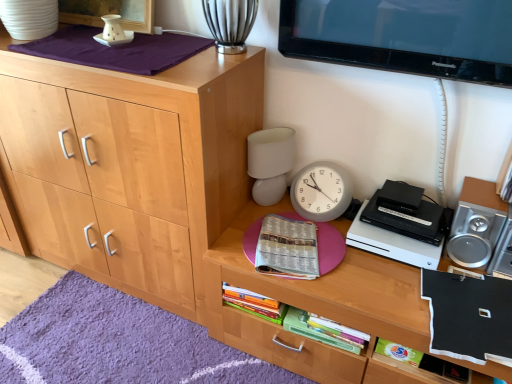
How much space does black matte book at lower right, acting as the 1th book starting from the right, occupy vertically?

The height of black matte book at lower right, acting as the 1th book starting from the right, is 1.84 inches.

The width and height of the screenshot is (512, 384). Describe the element at coordinates (469, 316) in the screenshot. I see `black matte book at lower right, the 3th book from the left` at that location.

This screenshot has height=384, width=512. In order to click on natural wood cabinet at left in this screenshot , I will do `click(130, 165)`.

What do you see at coordinates (423, 363) in the screenshot?
I see `green matte book at lower right, the 2th book when ordered from left to right` at bounding box center [423, 363].

This screenshot has height=384, width=512. What are the coordinates of `white matte table lamp at center-right` in the screenshot? It's located at (270, 163).

Measure the distance between natural wood cabinet at left and purple soft rug at lower left.

natural wood cabinet at left is 49.79 centimeters from purple soft rug at lower left.

Can you confirm if natural wood cabinet at left is shorter than purple soft rug at lower left?

Incorrect, the height of natural wood cabinet at left does not fall short of that of purple soft rug at lower left.

Is natural wood cabinet at left not inside purple soft rug at lower left?

natural wood cabinet at left lies outside purple soft rug at lower left's area.

In order to click on mat beneath the natural wood cabinet at left (from a real-world perspective) in this screenshot , I will do `click(118, 343)`.

Are black plastic dvd player at right and wooden desk at center making contact?

No, black plastic dvd player at right is not next to wooden desk at center.

Who is shorter, black plastic dvd player at right or wooden desk at center?

black plastic dvd player at right.

From a real-world perspective, which is physically above, black plastic dvd player at right or wooden desk at center?

black plastic dvd player at right is physically above.

From the image's perspective, who appears lower, natural wood cabinet at left or black plastic dvd player at right?

From the image's view, black plastic dvd player at right is below.

Consider the image. Is natural wood cabinet at left not within black plastic dvd player at right?

That's correct, natural wood cabinet at left is outside of black plastic dvd player at right.

Does natural wood cabinet at left have a lesser height compared to black plastic dvd player at right?

No, natural wood cabinet at left is not shorter than black plastic dvd player at right.

Is natural wood cabinet at left smaller than black plastic dvd player at right?

Incorrect, natural wood cabinet at left is not smaller in size than black plastic dvd player at right.

Is printed paper book at center, the third book from the right, oriented towards wooden desk at center?

No, printed paper book at center, the third book from the right, is not turned towards wooden desk at center.

From a real-world perspective, between printed paper book at center, positioned as the 1th book in left-to-right order, and wooden desk at center, who is vertically lower?

From a 3D spatial view, wooden desk at center is below.

In the scene shown: From the image's perspective, does printed paper book at center, positioned as the 1th book in left-to-right order, appear lower than wooden desk at center?

Actually, printed paper book at center, positioned as the 1th book in left-to-right order, appears above wooden desk at center in the image.

Which of these two, printed paper book at center, the third book from the right, or wooden desk at center, stands taller?

Standing taller between the two is wooden desk at center.

Between green matte book at lower right, marked as the second book in a right-to-left arrangement, and black matte book at lower right, the 3th book from the left, which one has smaller size?

green matte book at lower right, marked as the second book in a right-to-left arrangement.

Is green matte book at lower right, marked as the second book in a right-to-left arrangement, wider than black matte book at lower right, the 3th book from the left?

In fact, green matte book at lower right, marked as the second book in a right-to-left arrangement, might be narrower than black matte book at lower right, the 3th book from the left.

From the image's perspective, is green matte book at lower right, marked as the second book in a right-to-left arrangement, on top of black matte book at lower right, the 3th book from the left?

No, from the image's perspective, green matte book at lower right, marked as the second book in a right-to-left arrangement, is not above black matte book at lower right, the 3th book from the left.

Is green matte book at lower right, the 2th book when ordered from left to right, with black matte book at lower right, the 3th book from the left?

No, green matte book at lower right, the 2th book when ordered from left to right, is not in contact with black matte book at lower right, the 3th book from the left.

Considering the relative positions of black matte book at lower right, the 3th book from the left, and purple soft rug at lower left in the image provided, is black matte book at lower right, the 3th book from the left, in front of purple soft rug at lower left?

Yes, black matte book at lower right, the 3th book from the left, is closer to the viewer.

Between black matte book at lower right, acting as the 1th book starting from the right, and purple soft rug at lower left, which one has larger size?

Bigger between the two is purple soft rug at lower left.

This screenshot has height=384, width=512. Identify the location of mat on the left of black matte book at lower right, the 3th book from the left. (118, 343).

Considering the positions of objects black matte book at lower right, acting as the 1th book starting from the right, and purple soft rug at lower left in the image provided, who is more to the left, black matte book at lower right, acting as the 1th book starting from the right, or purple soft rug at lower left?

Positioned to the left is purple soft rug at lower left.

Could you tell me if wooden desk at center is turned towards black matte book at lower right, acting as the 1th book starting from the right?

No, wooden desk at center does not turn towards black matte book at lower right, acting as the 1th book starting from the right.

Can you confirm if wooden desk at center is positioned to the left of black matte book at lower right, the 3th book from the left?

Indeed, wooden desk at center is positioned on the left side of black matte book at lower right, the 3th book from the left.

Can we say wooden desk at center lies outside black matte book at lower right, the 3th book from the left?

Yes, wooden desk at center is not within black matte book at lower right, the 3th book from the left.

Does wooden desk at center have a lesser width compared to black matte book at lower right, acting as the 1th book starting from the right?

No.

Find the location of `cabinetry above the purple soft rug at lower left (from the image's perspective)`. cabinetry above the purple soft rug at lower left (from the image's perspective) is located at coordinates (130, 165).

At what (x,y) coordinates should I click in order to perform the action: click on desk in front of the black plastic dvd player at right. Please return your answer as a coordinate pair (x, y). The image size is (512, 384). Looking at the image, I should click on (314, 305).

Estimate the real-world distances between objects in this image. Which object is closer to purple soft rug at lower left, white matte table lamp at center-right or black matte book at lower right, acting as the 1th book starting from the right?

white matte table lamp at center-right.

Which object lies nearer to the anchor point wooden desk at center, natural wood cabinet at left or white matte table lamp at center-right?

Among the two, white matte table lamp at center-right is located nearer to wooden desk at center.

Which object lies nearer to the anchor point purple soft rug at lower left, black plastic dvd player at right or black matte book at lower right, the 3th book from the left?

The object closer to purple soft rug at lower left is black plastic dvd player at right.

Which object lies nearer to the anchor point natural wood cabinet at left, purple soft rug at lower left or black matte book at lower right, the 3th book from the left?

purple soft rug at lower left is closer to natural wood cabinet at left.

Estimate the real-world distances between objects in this image. Which object is closer to black matte book at lower right, the 3th book from the left, white matte table lamp at center-right or natural wood cabinet at left?

Among the two, white matte table lamp at center-right is located nearer to black matte book at lower right, the 3th book from the left.

When comparing their distances from black plastic dvd player at right, does natural wood cabinet at left or black matte book at lower right, acting as the 1th book starting from the right, seem further?

The object further to black plastic dvd player at right is natural wood cabinet at left.

Which object lies further to the anchor point white matte table lamp at center-right, natural wood cabinet at left or wooden desk at center?

Based on the image, natural wood cabinet at left appears to be further to white matte table lamp at center-right.

Estimate the real-world distances between objects in this image. Which object is further from white matte table lamp at center-right, black matte book at lower right, acting as the 1th book starting from the right, or natural wood cabinet at left?

black matte book at lower right, acting as the 1th book starting from the right.

I want to click on book situated between natural wood cabinet at left and black plastic dvd player at right from left to right, so click(x=287, y=248).

You are a GUI agent. You are given a task and a screenshot of the screen. Output one action in this format:
    pyautogui.click(x=<x>, y=<y>)
    Task: Click on the home appliance between printed paper book at center, the third book from the right, and green matte book at lower right, the 2th book when ordered from left to right, in the horizontal direction
    The width and height of the screenshot is (512, 384).
    Given the screenshot: What is the action you would take?
    pyautogui.click(x=401, y=226)

Identify the location of table lamp between natural wood cabinet at left and black plastic dvd player at right. The width and height of the screenshot is (512, 384). (270, 163).

Identify the location of book between purple soft rug at lower left and green matte book at lower right, the 2th book when ordered from left to right, from left to right. (287, 248).